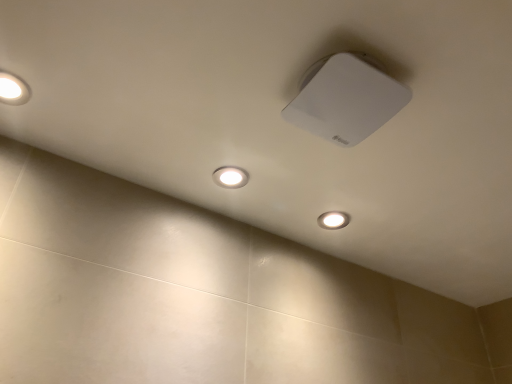
Question: Is matte white light at upper left, the second lamp viewed from the right, closer to camera compared to white matte square at upper center, which is counted as the first lamp, starting from the right?

Choices:
 (A) yes
 (B) no

Answer: (B)

Question: Considering the relative sizes of matte white light at upper left, the second lamp viewed from the right, and white matte square at upper center, positioned as the 2th lamp in left-to-right order, in the image provided, is matte white light at upper left, the second lamp viewed from the right, thinner than white matte square at upper center, positioned as the 2th lamp in left-to-right order,?

Choices:
 (A) yes
 (B) no

Answer: (A)

Question: Is matte white light at upper left, the second lamp viewed from the right, positioned behind white matte square at upper center, which is counted as the first lamp, starting from the right?

Choices:
 (A) yes
 (B) no

Answer: (A)

Question: Does matte white light at upper left, the first lamp in the left-to-right sequence, have a greater height compared to white matte square at upper center, which is counted as the first lamp, starting from the right?

Choices:
 (A) no
 (B) yes

Answer: (A)

Question: Considering the relative sizes of matte white light at upper left, the first lamp in the left-to-right sequence, and white matte square at upper center, positioned as the 2th lamp in left-to-right order, in the image provided, is matte white light at upper left, the first lamp in the left-to-right sequence, smaller than white matte square at upper center, positioned as the 2th lamp in left-to-right order,?

Choices:
 (A) yes
 (B) no

Answer: (A)

Question: Is matte white light at upper left, the second lamp viewed from the right, to the left of white matte square at upper center, which is counted as the first lamp, starting from the right, from the viewer's perspective?

Choices:
 (A) yes
 (B) no

Answer: (A)

Question: Can you confirm if white matte square at upper center, which is counted as the first lamp, starting from the right, is wider than matte white light at upper left, the second lamp viewed from the right?

Choices:
 (A) yes
 (B) no

Answer: (A)

Question: Does white matte square at upper center, which is counted as the first lamp, starting from the right, have a larger size compared to matte white light at upper left, the second lamp viewed from the right?

Choices:
 (A) yes
 (B) no

Answer: (A)

Question: Can you confirm if white matte square at upper center, which is counted as the first lamp, starting from the right, is smaller than matte white light at upper left, the second lamp viewed from the right?

Choices:
 (A) no
 (B) yes

Answer: (A)

Question: Does white matte square at upper center, positioned as the 2th lamp in left-to-right order, contain matte white light at upper left, the first lamp in the left-to-right sequence?

Choices:
 (A) no
 (B) yes

Answer: (A)

Question: From a real-world perspective, does white matte square at upper center, which is counted as the first lamp, starting from the right, sit lower than matte white light at upper left, the first lamp in the left-to-right sequence?

Choices:
 (A) no
 (B) yes

Answer: (B)

Question: Does white matte square at upper center, which is counted as the first lamp, starting from the right, have a lesser height compared to matte white light at upper left, the first lamp in the left-to-right sequence?

Choices:
 (A) no
 (B) yes

Answer: (A)

Question: Is matte white light at lower center beside matte white light at upper left, the first lamp in the left-to-right sequence?

Choices:
 (A) yes
 (B) no

Answer: (B)